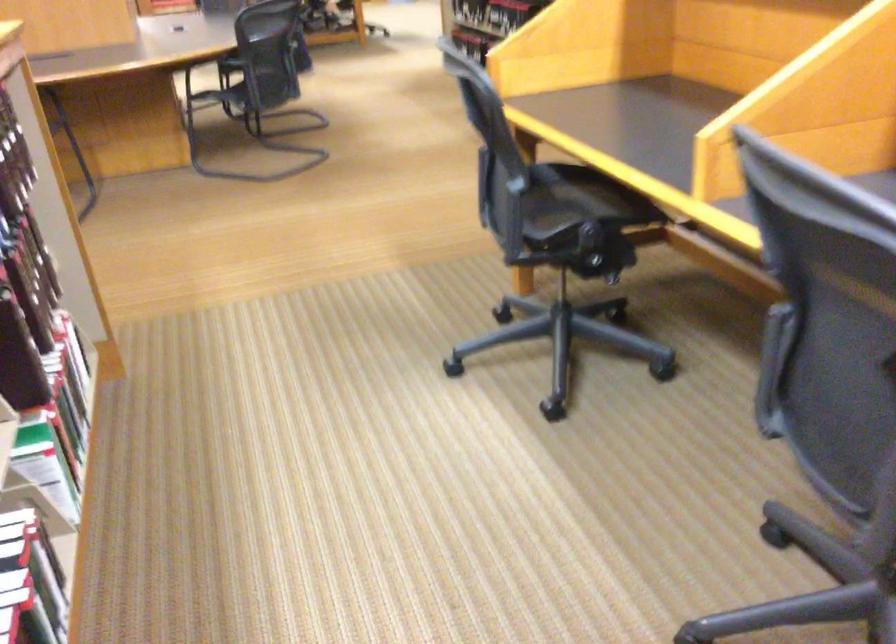
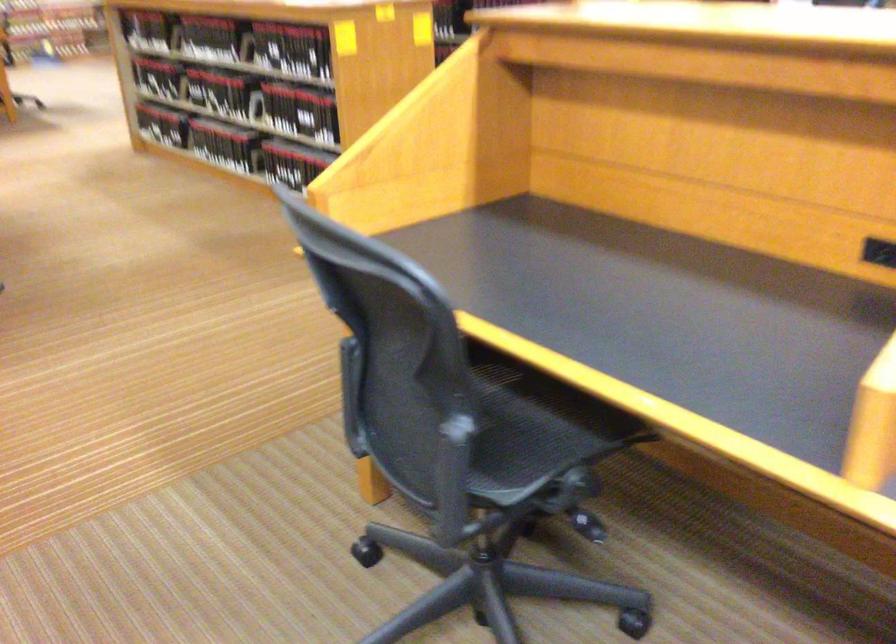
Question: In a continuous first-person perspective shot, in which direction is the camera moving?

Choices:
 (A) Left
 (B) Right
 (C) Forward
 (D) Backward

Answer: (C)